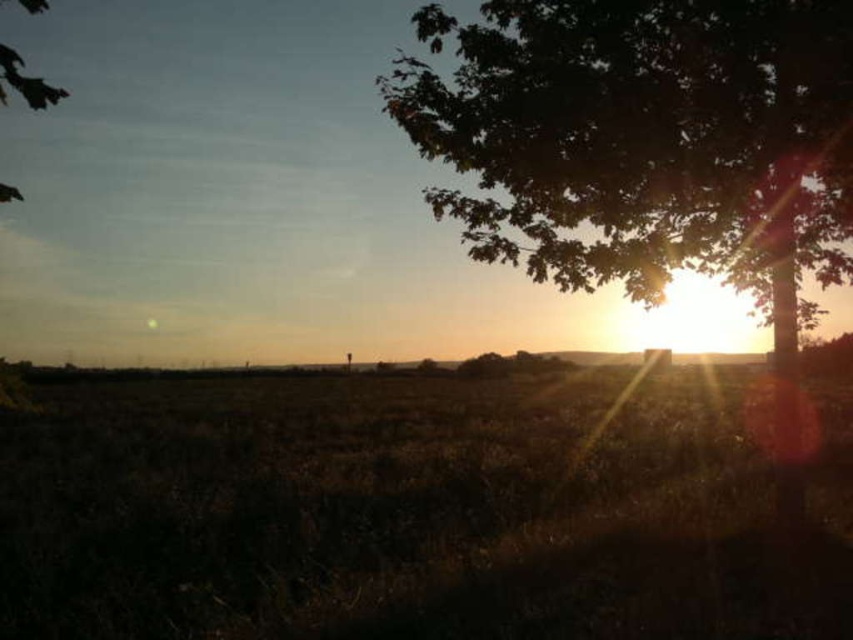
In the scene shown: You are an artist setting up your easel to paint the landscape. You want to capture both the green leafy tree at upper right and the green leafy tree at upper left in your painting. Which tree should you focus on to ensure it takes up more space in your canvas?

The green leafy tree at upper left should be focused on because its width is greater than the green leafy tree at upper right, making it larger and thus occupying more space in the painting.

You are standing in the field and want to take a photo of the green leafy tree at upper left. To get the best shot, should you position yourself closer to the brown grassy at center or further away from it?

You should position yourself closer to the brown grassy at center because it is below the green leafy tree at upper left, so being closer will allow you to capture both the tree and the grassy area in the foreground without obstruction.